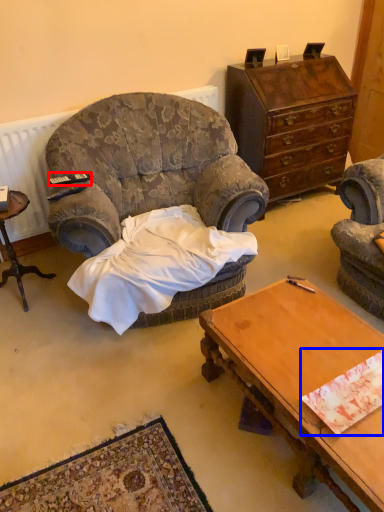
Question: Which object appears farthest to the camera in this image, remote control (highlighted by a red box) or sheet (highlighted by a blue box)?

Choices:
 (A) remote control
 (B) sheet

Answer: (A)